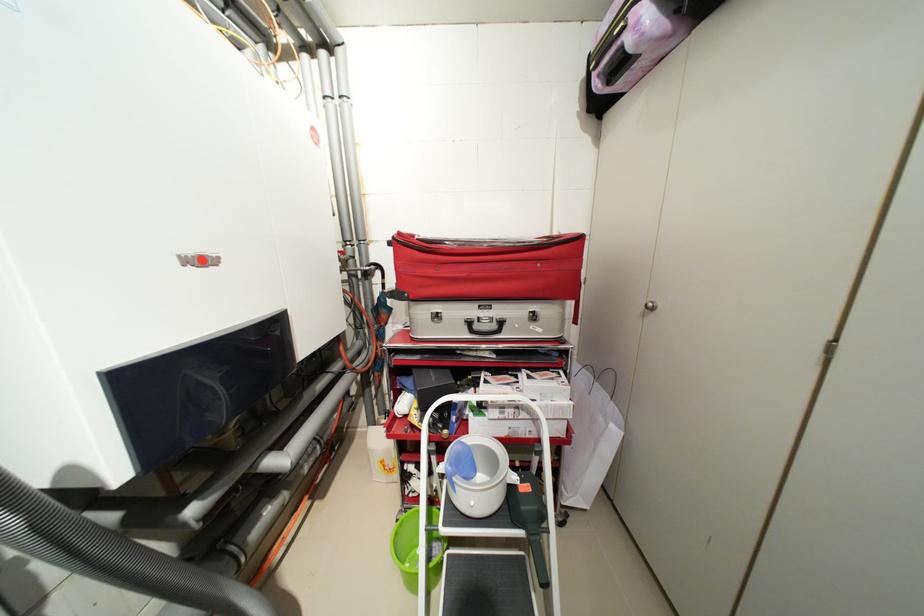
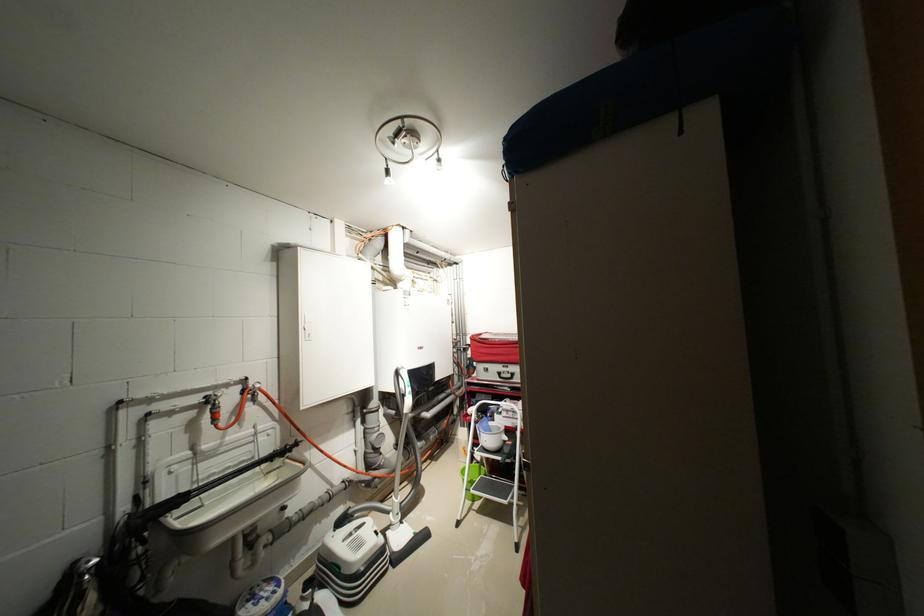
Where in the second image is the point corresponding to point 436,454 from the first image?

(482, 424)